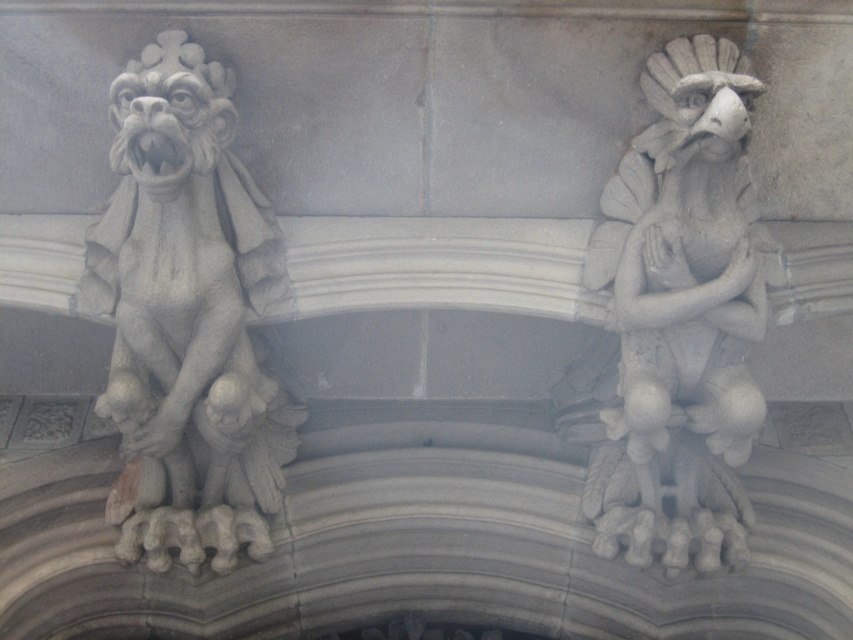
You are an architect measuring the spacing between the gray stone gargoyle at left and the white stone gargoyle at right for a restoration project. The minimum required distance for safe restoration work is 18 inches. Can the current spacing between them accommodate this requirement?

The gray stone gargoyle at left is 18.40 inches away from the white stone gargoyle at right, which exceeds the minimum required distance of 18 inches. Therefore, the current spacing can accommodate the safe restoration work.

You are an architect designing a replica of this historical structure. The two stone figures must be placed exactly 10 feet apart for structural balance. Given that the gray stone gargoyle at left and the other figure are currently 9.72 feet apart, will you need to adjust their positions to meet the requirement?

The gray stone gargoyle at left and the other figure are currently 9.72 feet apart, which is 2.8 inches less than the required 10 feet. Therefore, you will need to adjust their positions to achieve the correct distance of 10 feet for structural balance.

You are an art restorer examining the architectural detail. You need to clean both the gray stone gargoyle at left and the white stone gargoyle at right. Which gargoyle will require you to climb higher to reach?

The white stone gargoyle at right is further from the viewer than the gray stone gargoyle at left, so you will need to climb higher to reach the white stone gargoyle at right.